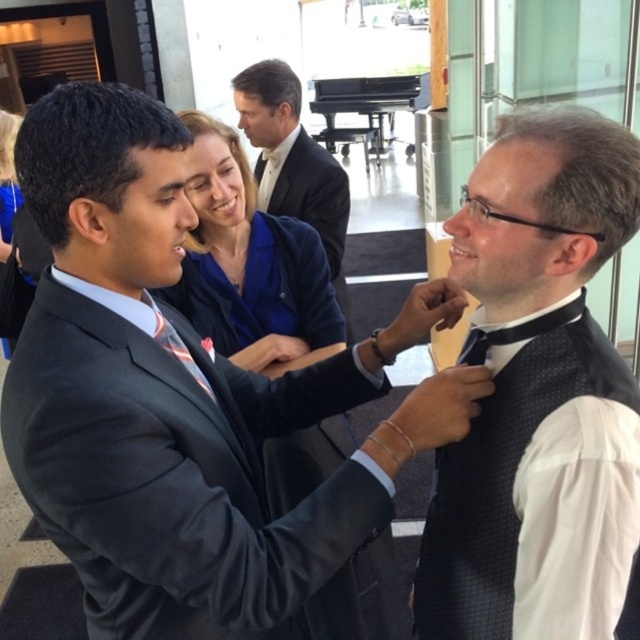
Question: Which point is closer to the camera taking this photo?

Choices:
 (A) (272, 160)
 (B) (280, 209)
 (C) (100, 292)
 (D) (209, 202)

Answer: (C)

Question: Estimate the real-world distances between objects in this image. Which object is farther from the black dotted vest at right?

Choices:
 (A) black satin bow tie at center
 (B) dark blue fabric suit at center
 (C) blue fabric dress at center

Answer: (C)

Question: Is the position of dark blue fabric suit at center more distant than that of black satin bow tie at center?

Choices:
 (A) no
 (B) yes

Answer: (A)

Question: Is matte black suit at center below black dotted vest at right?

Choices:
 (A) yes
 (B) no

Answer: (A)

Question: Which of these objects is positioned closest to the blue fabric jacket at upper center?

Choices:
 (A) blue fabric dress at center
 (B) matte black suit at center
 (C) black satin bow tie at center
 (D) black dotted vest at right

Answer: (B)

Question: Observing the image, what is the correct spatial positioning of matte black suit at center in reference to black satin bow tie at center?

Choices:
 (A) left
 (B) right

Answer: (B)